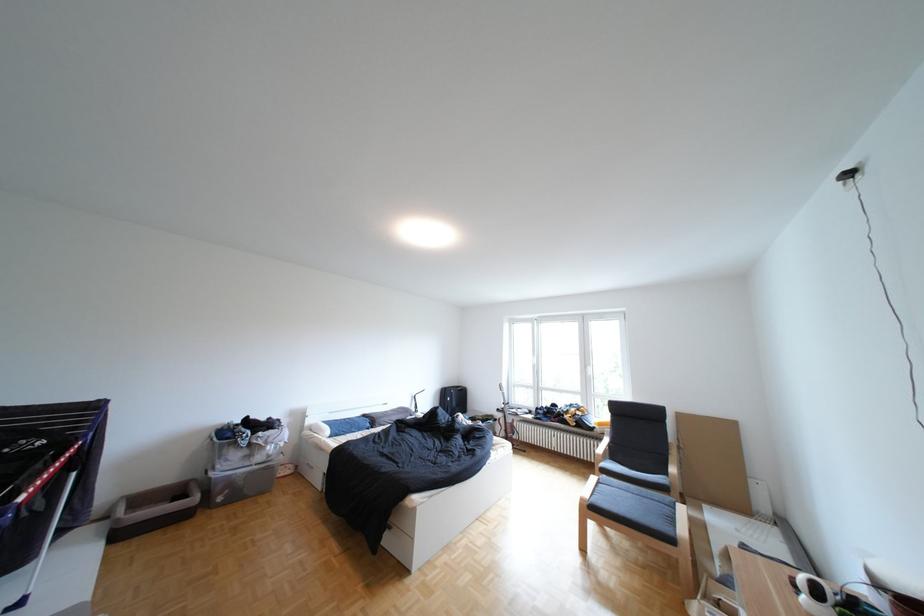
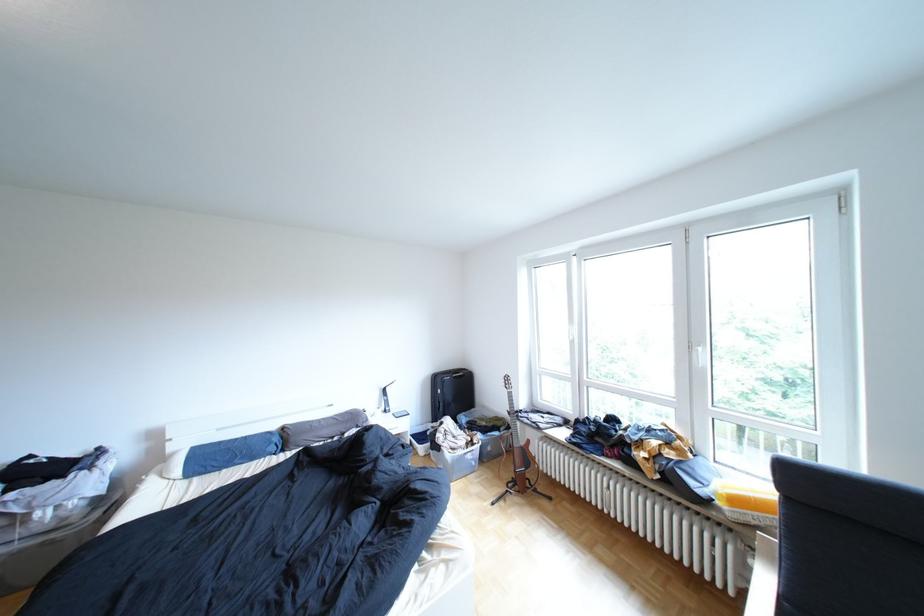
Where in the second image is the point corresponding to pixel 459 392 from the first image?

(452, 379)